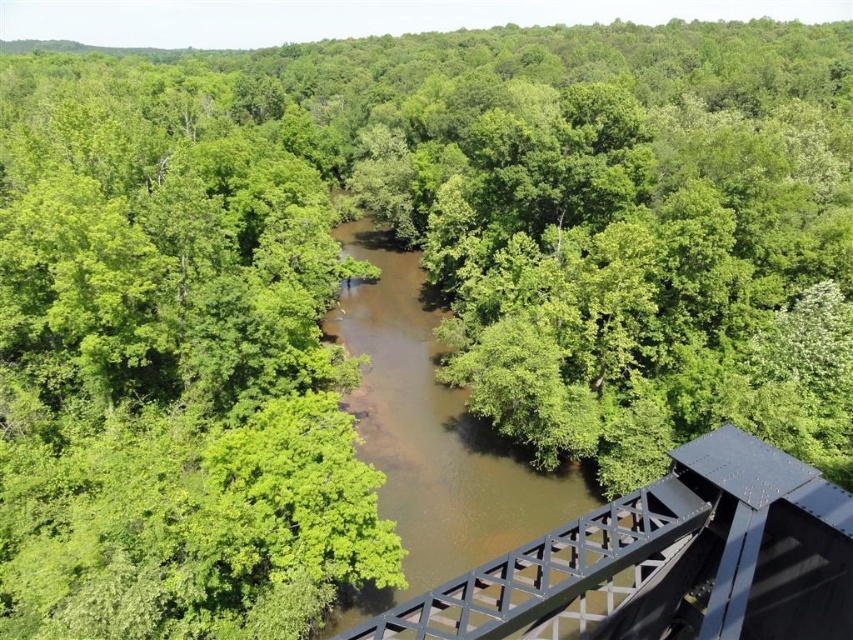
Question: Which object is closer to the camera taking this photo?

Choices:
 (A) brown muddy water at center
 (B) black metal train bridge at center

Answer: (B)

Question: Where is black metal train bridge at center located in relation to brown muddy water at center in the image?

Choices:
 (A) below
 (B) above

Answer: (A)

Question: Among these points, which one is nearest to the camera?

Choices:
 (A) (503, 573)
 (B) (479, 550)

Answer: (A)

Question: Which point is farther to the camera?

Choices:
 (A) black metal train bridge at center
 (B) brown muddy water at center

Answer: (B)

Question: Is black metal train bridge at center in front of brown muddy water at center?

Choices:
 (A) no
 (B) yes

Answer: (B)

Question: Can you confirm if black metal train bridge at center is thinner than brown muddy water at center?

Choices:
 (A) no
 (B) yes

Answer: (B)